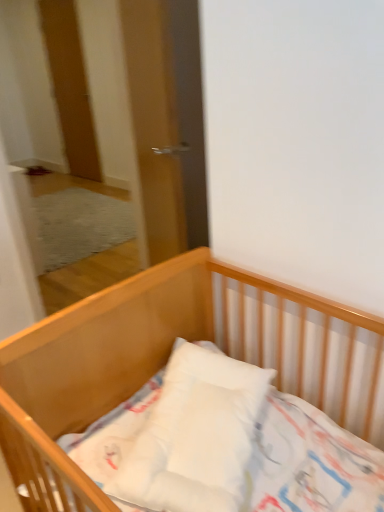
Question: Should I look upward or downward to see wooden crib at center?

Choices:
 (A) down
 (B) up

Answer: (A)

Question: Would you say wooden crib at center is a long distance from wooden door at upper left?

Choices:
 (A) no
 (B) yes

Answer: (B)

Question: Does wooden crib at center have a lesser width compared to wooden door at upper left?

Choices:
 (A) no
 (B) yes

Answer: (A)

Question: Is wooden crib at center looking in the opposite direction of wooden door at upper left?

Choices:
 (A) yes
 (B) no

Answer: (B)

Question: From the image's perspective, is wooden crib at center located beneath wooden door at upper left?

Choices:
 (A) yes
 (B) no

Answer: (A)

Question: Does wooden crib at center have a greater width compared to wooden door at upper left?

Choices:
 (A) no
 (B) yes

Answer: (B)

Question: From the image's perspective, is wooden crib at center located above wooden door at upper left?

Choices:
 (A) yes
 (B) no

Answer: (B)

Question: Considering the relative sizes of wooden door at upper left and wooden crib at center in the image provided, is wooden door at upper left wider than wooden crib at center?

Choices:
 (A) no
 (B) yes

Answer: (A)

Question: From the image's perspective, is wooden door at upper left located beneath wooden crib at center?

Choices:
 (A) yes
 (B) no

Answer: (B)

Question: Does wooden door at upper left lie behind wooden crib at center?

Choices:
 (A) yes
 (B) no

Answer: (A)

Question: Considering the relative positions of wooden door at upper left and wooden crib at center in the image provided, is wooden door at upper left to the right of wooden crib at center from the viewer's perspective?

Choices:
 (A) yes
 (B) no

Answer: (B)

Question: Does wooden door at upper left have a lesser width compared to wooden crib at center?

Choices:
 (A) no
 (B) yes

Answer: (B)

Question: Is wooden door at upper left in contact with wooden crib at center?

Choices:
 (A) yes
 (B) no

Answer: (B)

Question: From a real-world perspective, is wooden door at upper left located higher than transparent glass door at center?

Choices:
 (A) no
 (B) yes

Answer: (B)